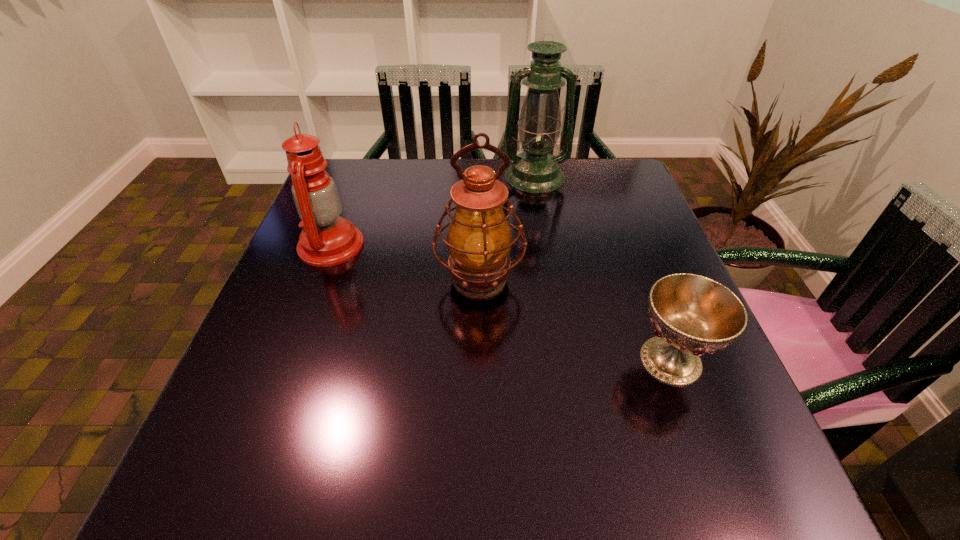
Find the location of `vacant space at the far edge of the desktop`. vacant space at the far edge of the desktop is located at coordinates (564, 167).

This screenshot has width=960, height=540. I want to click on vacant space at the near edge of the desktop, so click(x=499, y=468).

The height and width of the screenshot is (540, 960). In the image, there is a desktop. Identify the location of vacant space at the left edge. (283, 414).

Image resolution: width=960 pixels, height=540 pixels. In order to click on vacant area at the right edge in this screenshot , I will do `click(592, 218)`.

The height and width of the screenshot is (540, 960). What are the coordinates of `free space at the far left corner of the desktop` in the screenshot? It's located at (355, 174).

In the image, there is a desktop. Identify the location of vacant space at the near left corner. (228, 488).

Identify the location of free spot at the far right corner of the desktop. (619, 163).

Where is `free region at the near right corner`? The width and height of the screenshot is (960, 540). free region at the near right corner is located at coordinates (695, 464).

The image size is (960, 540). Find the location of `free space between the farthest object and the rightmost object`. free space between the farthest object and the rightmost object is located at coordinates (603, 268).

At what (x,y) coordinates should I click in order to perform the action: click on vacant space that is in between the farthest object and the rightmost object. Please return your answer as a coordinate pair (x, y). The height and width of the screenshot is (540, 960). Looking at the image, I should click on (603, 268).